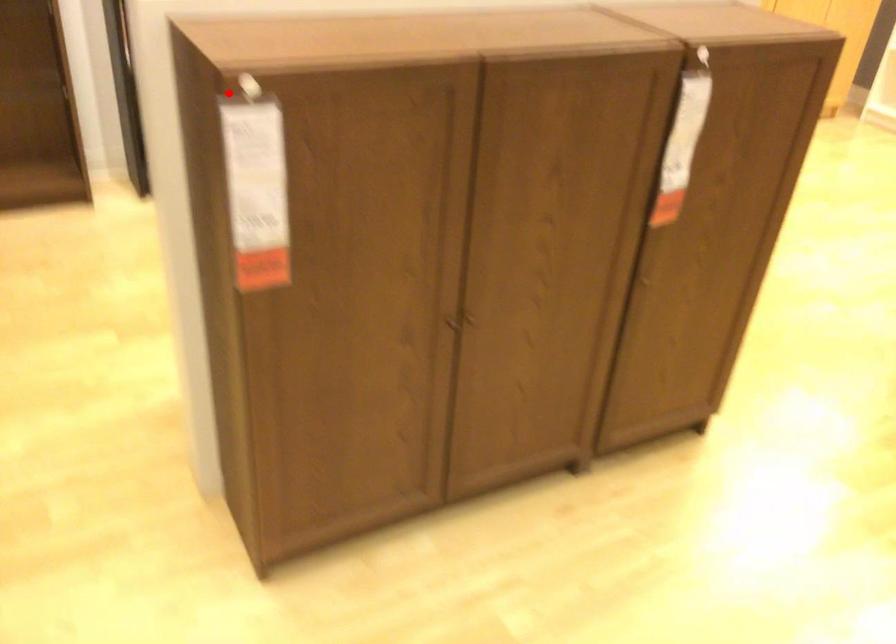
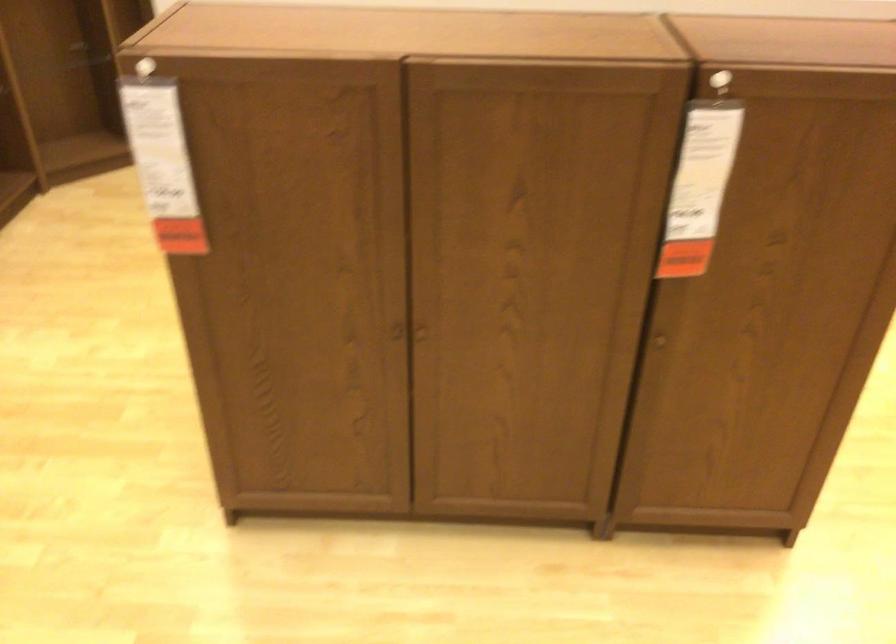
Where in the second image is the point corresponding to the highlighted location from the first image?

(143, 67)